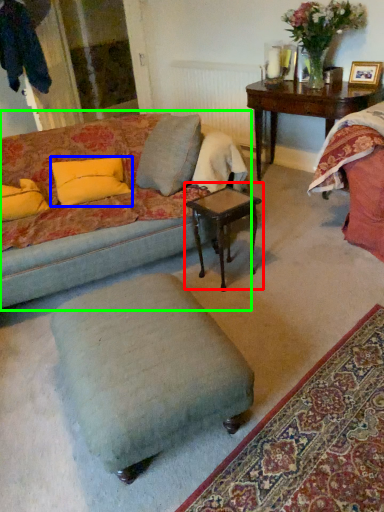
Question: Considering the real-world distances, which object is closest to coffee table (highlighted by a red box)? pillow (highlighted by a blue box) or studio couch (highlighted by a green box).

Choices:
 (A) pillow
 (B) studio couch

Answer: (B)